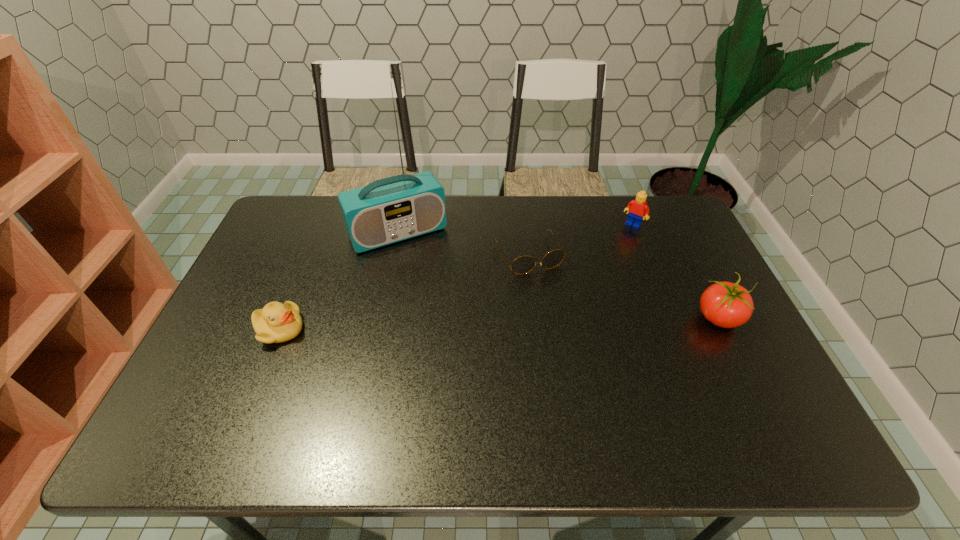
In order to click on vacant space located on the front panel of the tallest object in this screenshot , I will do `click(433, 285)`.

You are a GUI agent. You are given a task and a screenshot of the screen. Output one action in this format:
    pyautogui.click(x=<x>, y=<y>)
    Task: Click on the blank area located on the front panel of the tallest object
    Image resolution: width=960 pixels, height=540 pixels.
    Given the screenshot: What is the action you would take?
    click(x=437, y=291)

The height and width of the screenshot is (540, 960). Find the location of `blank space located on the front panel of the tallest object`. blank space located on the front panel of the tallest object is located at coordinates (437, 291).

Where is `free region located 0.250m on the face of the fourth object from left to right`? Image resolution: width=960 pixels, height=540 pixels. free region located 0.250m on the face of the fourth object from left to right is located at coordinates (596, 272).

Locate an element on the screen. vacant space located 0.290m on the face of the fourth object from left to right is located at coordinates (590, 280).

In order to click on free location located on the face of the fourth object from left to right in this screenshot , I will do `click(613, 249)`.

Find the location of a particular element. The width and height of the screenshot is (960, 540). free space located 0.280m on the lenses of the third object from right to left is located at coordinates (580, 350).

Identify the location of vacant space positioned on the lenses of the third object from right to left. The height and width of the screenshot is (540, 960). (572, 335).

Image resolution: width=960 pixels, height=540 pixels. Identify the location of free space located on the lenses of the third object from right to left. (577, 343).

I want to click on radio receiver situated at the far edge, so click(x=400, y=207).